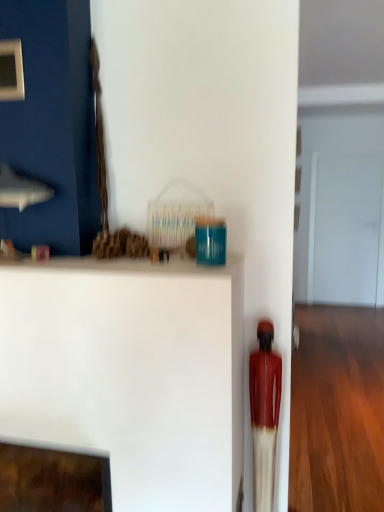
Question: From the image's perspective, is white matte shelf at center beneath matte red statue at right?

Choices:
 (A) yes
 (B) no

Answer: (A)

Question: Does white matte shelf at center lie behind matte red statue at right?

Choices:
 (A) yes
 (B) no

Answer: (B)

Question: Can you confirm if white matte shelf at center is taller than matte red statue at right?

Choices:
 (A) yes
 (B) no

Answer: (A)

Question: Considering the relative sizes of white matte shelf at center and matte red statue at right in the image provided, is white matte shelf at center smaller than matte red statue at right?

Choices:
 (A) no
 (B) yes

Answer: (A)

Question: From a real-world perspective, is white matte shelf at center under matte red statue at right?

Choices:
 (A) yes
 (B) no

Answer: (A)

Question: Is white matte shelf at center placed right next to matte red statue at right?

Choices:
 (A) yes
 (B) no

Answer: (B)

Question: From a real-world perspective, does transparent glass door at center stand above white matte shelf at center?

Choices:
 (A) no
 (B) yes

Answer: (B)

Question: Can you confirm if transparent glass door at center is positioned to the left of white matte shelf at center?

Choices:
 (A) yes
 (B) no

Answer: (B)

Question: Considering the relative sizes of transparent glass door at center and white matte shelf at center in the image provided, is transparent glass door at center thinner than white matte shelf at center?

Choices:
 (A) yes
 (B) no

Answer: (A)

Question: Is transparent glass door at center oriented away from white matte shelf at center?

Choices:
 (A) yes
 (B) no

Answer: (B)

Question: Is transparent glass door at center completely or partially outside of white matte shelf at center?

Choices:
 (A) yes
 (B) no

Answer: (A)

Question: Considering the relative sizes of transparent glass door at center and white matte shelf at center in the image provided, is transparent glass door at center wider than white matte shelf at center?

Choices:
 (A) no
 (B) yes

Answer: (A)

Question: Is matte red statue at right wider than transparent glass door at center?

Choices:
 (A) no
 (B) yes

Answer: (B)